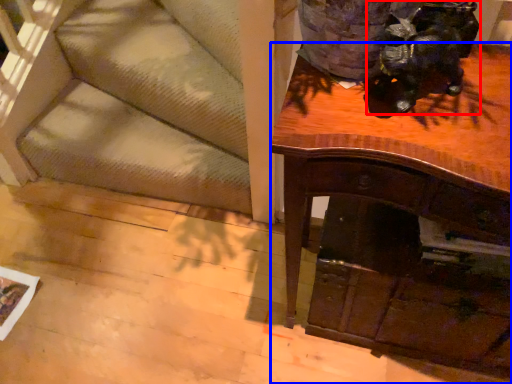
Question: Which of the following is the closest to the observer, animal (highlighted by a red box) or desk (highlighted by a blue box)?

Choices:
 (A) animal
 (B) desk

Answer: (B)